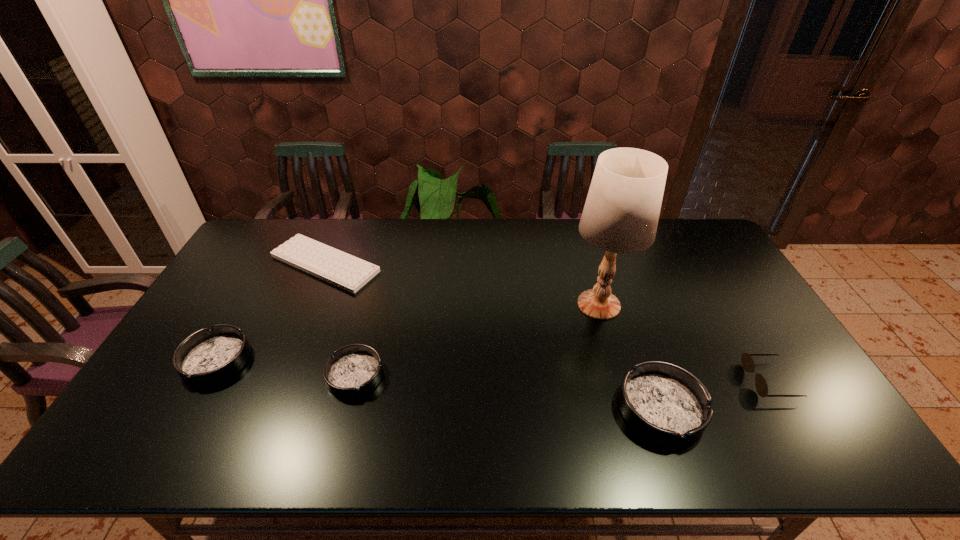
Where is `vacant region located on the right of the shortest object`? The image size is (960, 540). vacant region located on the right of the shortest object is located at coordinates (444, 264).

The width and height of the screenshot is (960, 540). I want to click on vacant area situated on the front-facing side of the rightmost object, so click(704, 381).

Where is `free space located 0.330m on the front-facing side of the rightmost object`? This screenshot has width=960, height=540. free space located 0.330m on the front-facing side of the rightmost object is located at coordinates (624, 381).

Image resolution: width=960 pixels, height=540 pixels. What are the coordinates of `vacant region located on the front-facing side of the rightmost object` in the screenshot? It's located at (708, 381).

At what (x,y) coordinates should I click in order to perform the action: click on free region located 0.280m on the right of the tallest object. Please return your answer as a coordinate pair (x, y). The height and width of the screenshot is (540, 960). Looking at the image, I should click on (721, 305).

This screenshot has width=960, height=540. Find the location of `object that is positioned at the far edge`. object that is positioned at the far edge is located at coordinates (348, 272).

Locate an element on the screen. The image size is (960, 540). sunglasses positioned at the near edge is located at coordinates (747, 362).

Find the location of `ashtray that is at the left edge`. ashtray that is at the left edge is located at coordinates (207, 357).

Find the location of a particular element. The height and width of the screenshot is (540, 960). computer keyboard that is at the left edge is located at coordinates (348, 272).

Where is `object at the right edge`? The image size is (960, 540). object at the right edge is located at coordinates (747, 362).